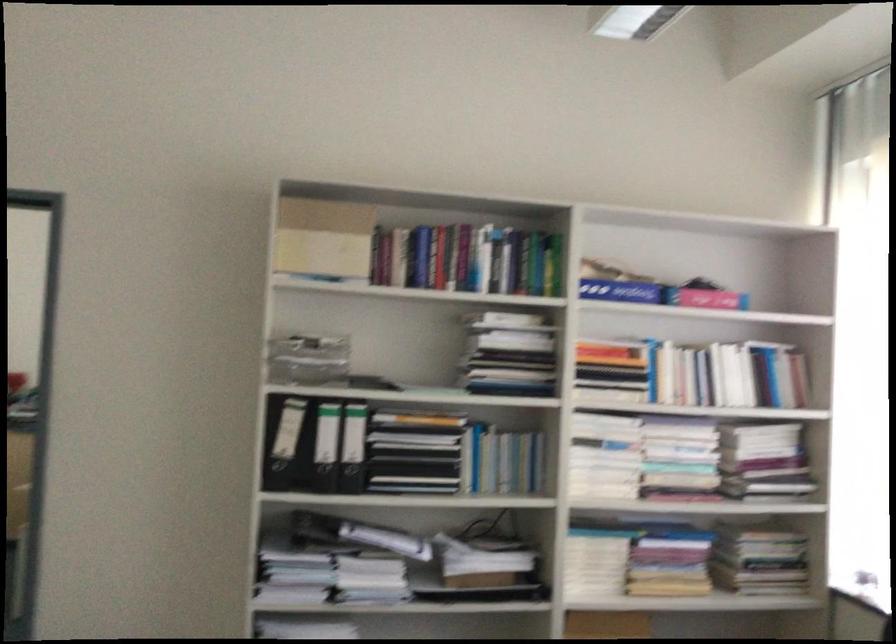
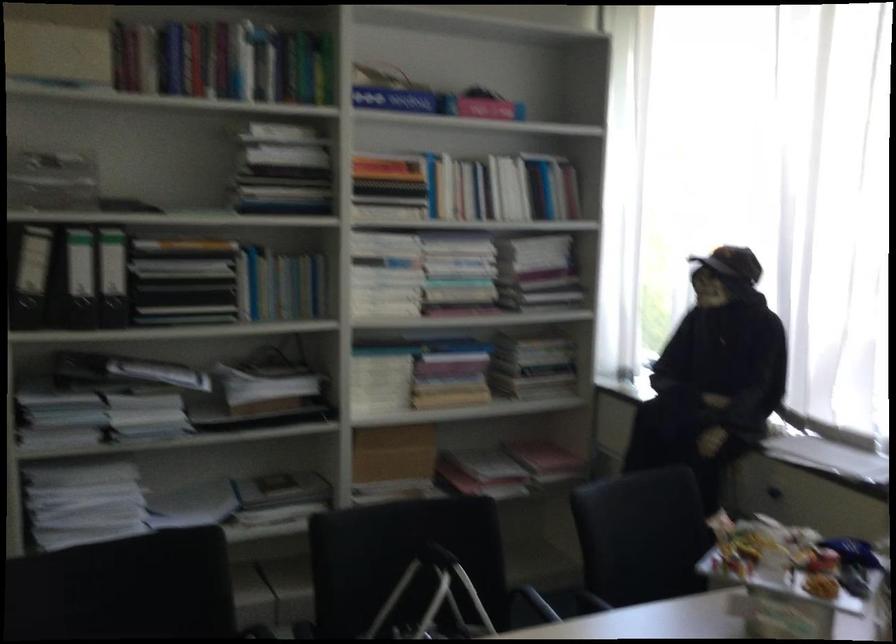
Where in the second image is the point corresponding to (x=319, y=448) from the first image?

(81, 279)